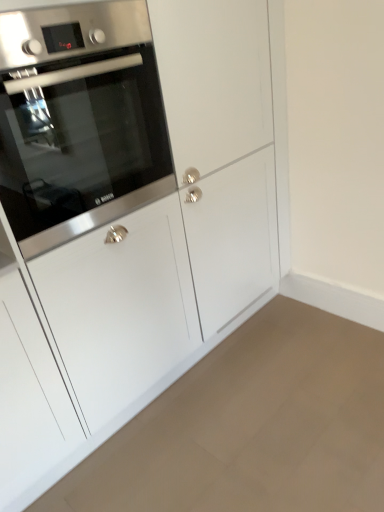
Question: From a real-world perspective, is stainless steel oven at left positioned under matte white cabinet at lower left based on gravity?

Choices:
 (A) no
 (B) yes

Answer: (A)

Question: Is stainless steel oven at left thinner than matte white cabinet at lower left?

Choices:
 (A) no
 (B) yes

Answer: (B)

Question: Is stainless steel oven at left positioned with its back to matte white cabinet at lower left?

Choices:
 (A) no
 (B) yes

Answer: (A)

Question: From a real-world perspective, is stainless steel oven at left on top of matte white cabinet at lower left?

Choices:
 (A) no
 (B) yes

Answer: (B)

Question: From the image's perspective, is stainless steel oven at left on matte white cabinet at lower left?

Choices:
 (A) no
 (B) yes

Answer: (B)

Question: Considering the relative sizes of stainless steel oven at left and matte white cabinet at lower left in the image provided, is stainless steel oven at left bigger than matte white cabinet at lower left?

Choices:
 (A) no
 (B) yes

Answer: (B)

Question: From the image's perspective, would you say matte white cabinet at lower left is shown under stainless steel oven at left?

Choices:
 (A) no
 (B) yes

Answer: (B)

Question: From the image's perspective, is matte white cabinet at lower left over stainless steel oven at left?

Choices:
 (A) yes
 (B) no

Answer: (B)

Question: From a real-world perspective, is matte white cabinet at lower left on stainless steel oven at left?

Choices:
 (A) yes
 (B) no

Answer: (B)

Question: Considering the relative sizes of matte white cabinet at lower left and stainless steel oven at left in the image provided, is matte white cabinet at lower left wider than stainless steel oven at left?

Choices:
 (A) no
 (B) yes

Answer: (B)

Question: Does matte white cabinet at lower left have a lesser height compared to stainless steel oven at left?

Choices:
 (A) yes
 (B) no

Answer: (A)

Question: Is matte white cabinet at lower left bigger than stainless steel oven at left?

Choices:
 (A) no
 (B) yes

Answer: (A)

Question: Looking at their shapes, would you say stainless steel oven at left is wider or thinner than matte white cabinet at lower left?

Choices:
 (A) wide
 (B) thin

Answer: (B)